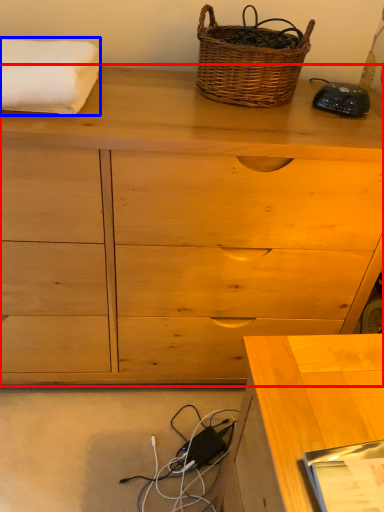
Question: Which point is further to the camera, chest of drawers (highlighted by a red box) or bath towel (highlighted by a blue box)?

Choices:
 (A) chest of drawers
 (B) bath towel

Answer: (B)